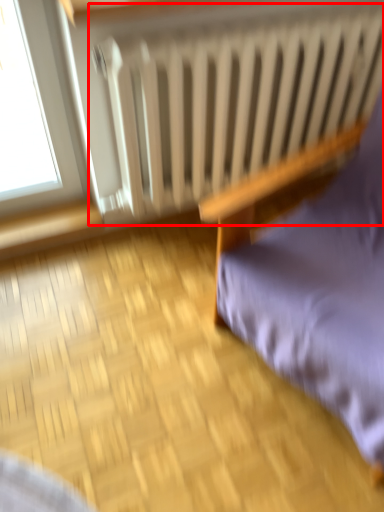
Question: From the image's perspective, what is the correct spatial relationship of radiator (annotated by the red box) in relation to furniture?

Choices:
 (A) below
 (B) above

Answer: (B)